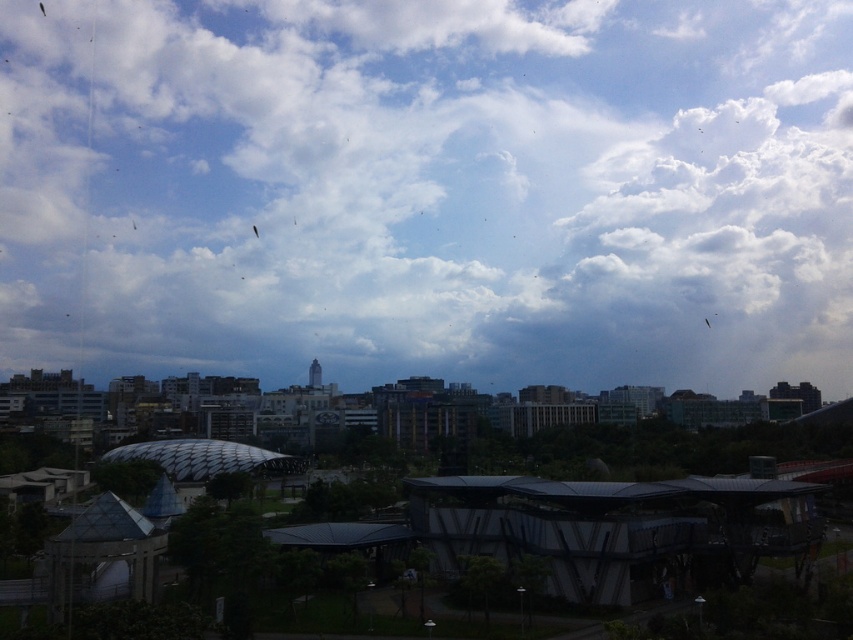
Question: Which point is farther from the camera taking this photo?

Choices:
 (A) click(x=526, y=128)
 (B) click(x=254, y=228)

Answer: (A)

Question: Is white fluffy cloud at upper center behind translucent plastic kite at upper center?

Choices:
 (A) no
 (B) yes

Answer: (A)

Question: Considering the relative positions of white fluffy cloud at upper center and translucent plastic kite at upper center in the image provided, where is white fluffy cloud at upper center located with respect to translucent plastic kite at upper center?

Choices:
 (A) below
 (B) above

Answer: (B)

Question: Which point appears farthest from the camera in this image?

Choices:
 (A) (256, 228)
 (B) (595, 166)

Answer: (B)

Question: In this image, where is white fluffy cloud at upper center located relative to translucent plastic kite at upper center?

Choices:
 (A) left
 (B) right

Answer: (B)